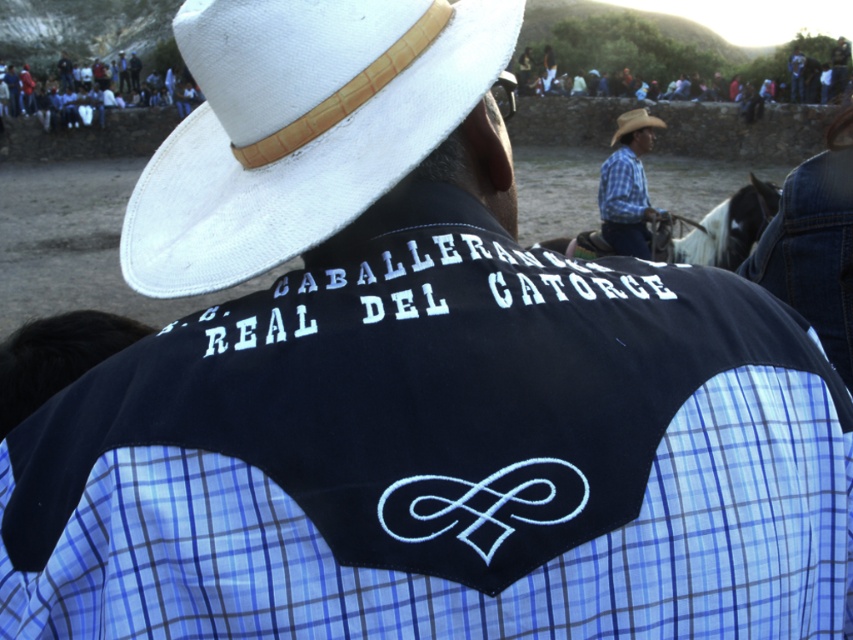
Question: Can you confirm if blue plaid shirt at center is thinner than blue jeans at upper center?

Choices:
 (A) yes
 (B) no

Answer: (A)

Question: Is white glossy horse at upper center further to camera compared to blue plaid shirt at center?

Choices:
 (A) no
 (B) yes

Answer: (A)

Question: Which of the following is the closest to the observer?

Choices:
 (A) white straw hat at upper center
 (B) blue plaid shirt at center
 (C) tan straw cowboy hat at upper center
 (D) blue jeans at upper center

Answer: (A)

Question: Which object appears closest to the camera in this image?

Choices:
 (A) white glossy horse at upper center
 (B) blue plaid shirt at center
 (C) tan straw cowboy hat at upper center

Answer: (A)

Question: Does white straw hat at upper center have a lesser width compared to tan straw cowboy hat at upper center?

Choices:
 (A) yes
 (B) no

Answer: (A)

Question: Among these points, which one is nearest to the camera?

Choices:
 (A) [143, 92]
 (B) [640, 116]

Answer: (B)